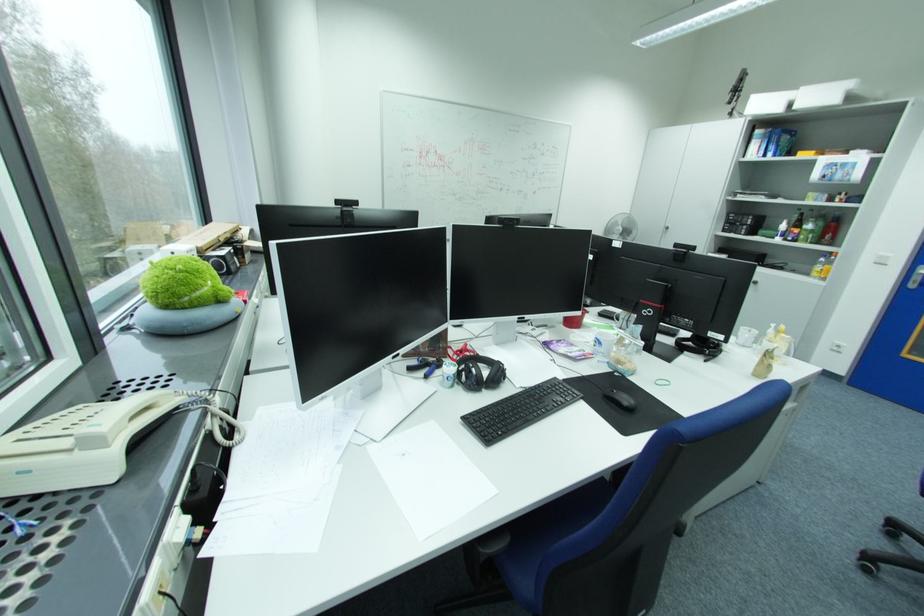
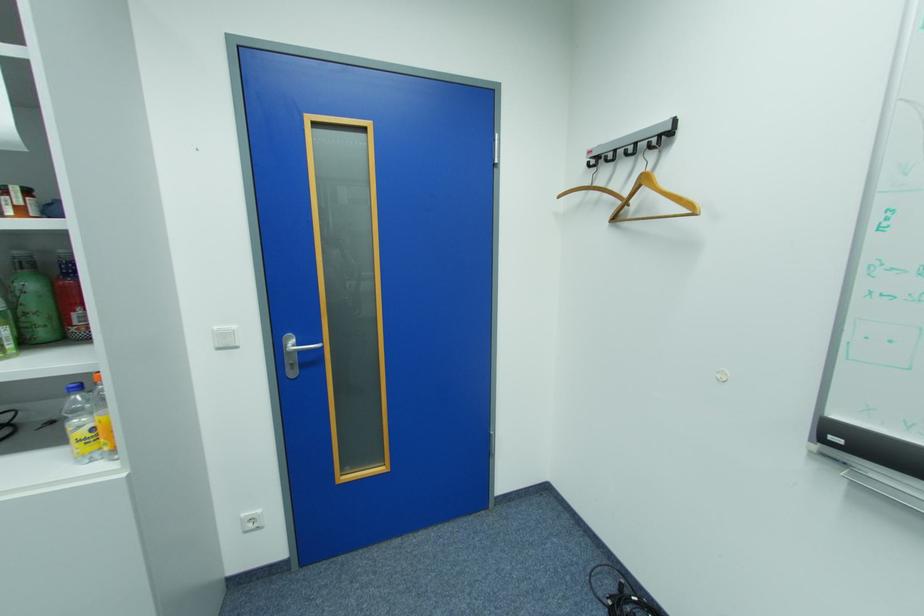
Question: I am providing you with two images of the same scene from different viewpoints. After the viewpoint changes to image2, which objects are now occluded?

Choices:
 (A) plastic water bottle
 (B) red glass bottle
 (C) wooden coat hanger
 (D) none of these

Answer: (D)